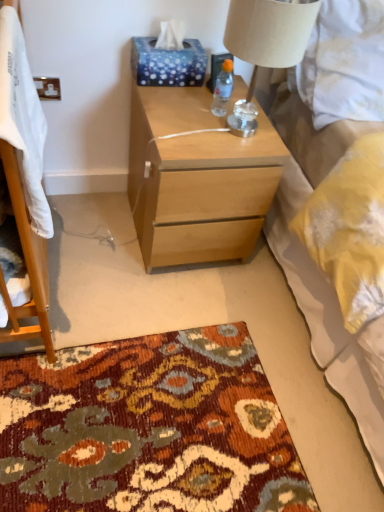
You are a GUI agent. You are given a task and a screenshot of the screen. Output one action in this format:
    pyautogui.click(x=<x>, y=<y>)
    Task: Click on the free space to the left of beige fabric lampshade at upper right
    The height and width of the screenshot is (512, 384).
    Given the screenshot: What is the action you would take?
    pyautogui.click(x=177, y=112)